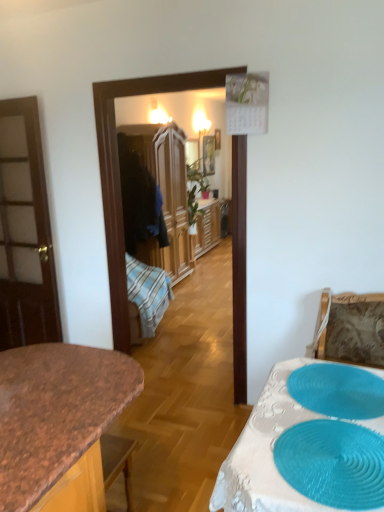
Locate an element on the screen. free region under teal rubber placemat at lower right, arranged as the 2th oval when viewed from the back (from a real-world perspective) is located at coordinates (333, 457).